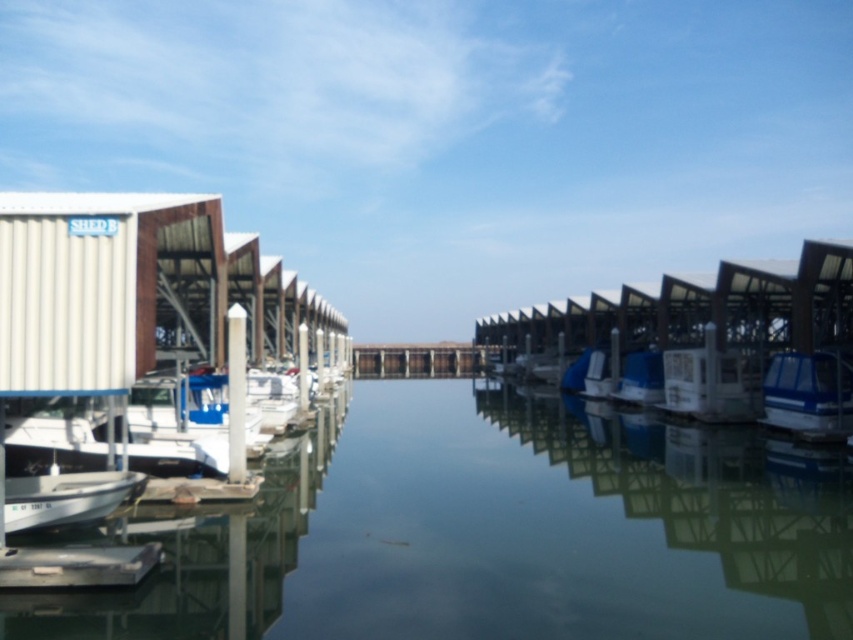
You are standing at the edge of the marina and see two points marked in the image. Which point, point [796,385] or point [659,374], is closer to you?

Point [796,385] is closer to the viewer than point [659,374].

You are a photographer planning to capture the reflection of the white matte boat at lower left and the clear glass water at center. Since the water is still, which object will have a more prominent reflection?

The clear glass water at center has a larger size than the white matte boat at lower left, so its reflection will be more prominent.